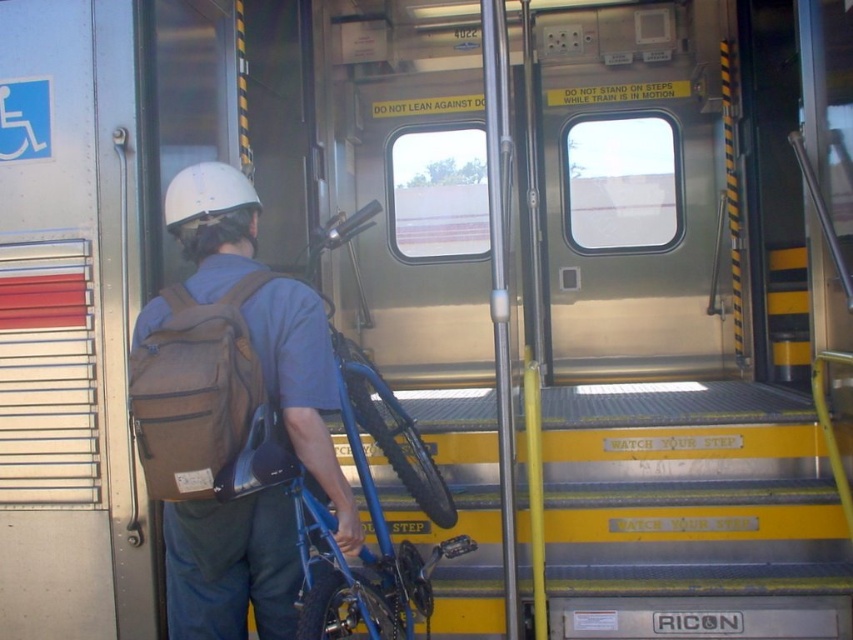
Question: Among these points, which one is nearest to the camera?

Choices:
 (A) (225, 282)
 (B) (239, 285)
 (C) (248, 337)

Answer: (C)

Question: Which object is positioned closest to the brown fabric strap at back?

Choices:
 (A) blue metallic bicycle at center
 (B) brown fabric backpack at center
 (C) brown fabric backpack at left

Answer: (B)

Question: Is blue metallic bicycle at center smaller than brown fabric strap at back?

Choices:
 (A) no
 (B) yes

Answer: (A)

Question: Which point is closer to the camera?

Choices:
 (A) brown fabric backpack at left
 (B) brown fabric strap at back

Answer: (A)

Question: Does brown fabric backpack at left have a greater width compared to brown fabric strap at back?

Choices:
 (A) yes
 (B) no

Answer: (A)

Question: Where is blue metallic bicycle at center located in relation to brown fabric backpack at center in the image?

Choices:
 (A) left
 (B) right

Answer: (B)